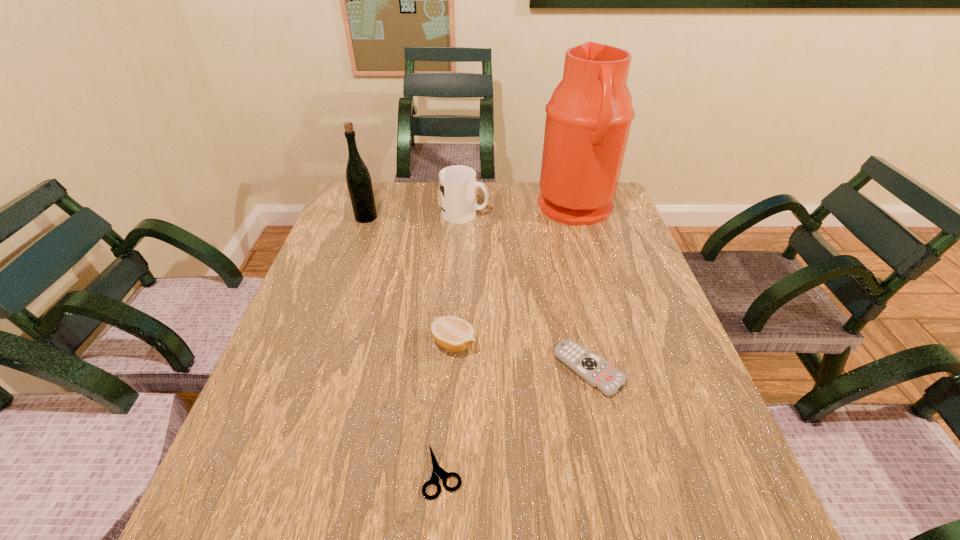
The height and width of the screenshot is (540, 960). Identify the location of vacant space positioned 0.240m from the spout of the tallest object. (461, 209).

You are a GUI agent. You are given a task and a screenshot of the screen. Output one action in this format:
    pyautogui.click(x=<x>, y=<y>)
    Task: Click on the vacant position located on the right of the leftmost object
    
    Given the screenshot: What is the action you would take?
    pyautogui.click(x=397, y=218)

The image size is (960, 540). Identify the location of free space located 0.330m on the handle side of the third tallest object. (596, 214).

I want to click on vacant area situated 0.070m on the right of the lemon, so click(508, 343).

In order to click on free space located on the left of the remote control in this screenshot , I will do `click(420, 369)`.

You are a GUI agent. You are given a task and a screenshot of the screen. Output one action in this format:
    pyautogui.click(x=<x>, y=<y>)
    Task: Click on the free space located 0.210m on the back of the nearest object
    The height and width of the screenshot is (540, 960).
    Given the screenshot: What is the action you would take?
    pyautogui.click(x=450, y=352)

I want to click on water jug located at the far edge, so click(x=588, y=118).

I want to click on beer bottle that is positioned at the far edge, so click(x=359, y=183).

Locate an element on the screen. The height and width of the screenshot is (540, 960). mug positioned at the far edge is located at coordinates (458, 184).

Locate an element on the screen. The image size is (960, 540). object located at the near edge is located at coordinates (438, 472).